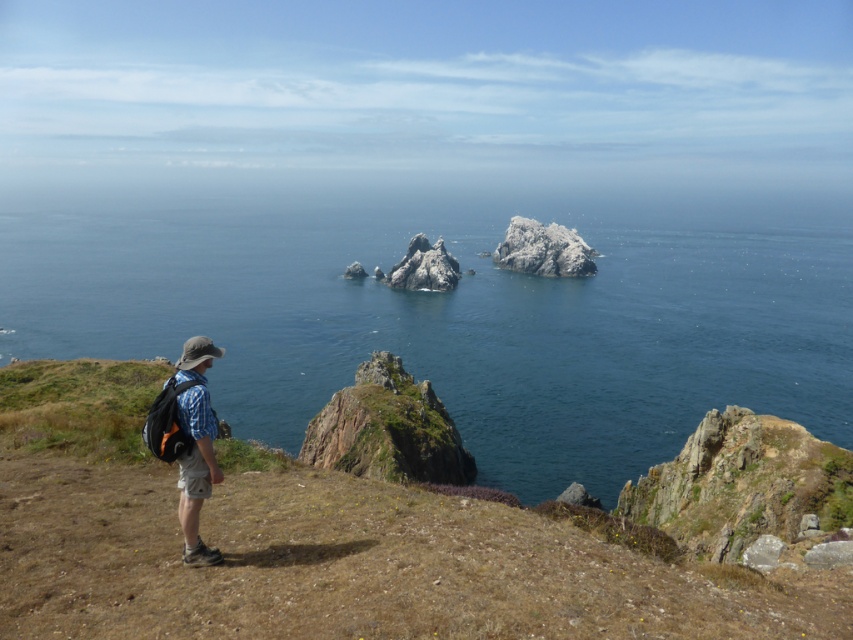
Between brown grassy hillside at lower left and rugged stone rock formation at center, which one has less height?

Standing shorter between the two is brown grassy hillside at lower left.

Can you confirm if brown grassy hillside at lower left is taller than rugged stone rock formation at center?

Incorrect, brown grassy hillside at lower left's height is not larger of rugged stone rock formation at center's.

Measure the distance between brown grassy hillside at lower left and camera.

They are 36.61 feet apart.

Locate an element on the screen. The image size is (853, 640). brown grassy hillside at lower left is located at coordinates (326, 545).

In the scene shown: Does blue water at center appear on the right side of white rocky island at center?

In fact, blue water at center is to the left of white rocky island at center.

Between blue water at center and white rocky island at center, which one is positioned higher?

blue water at center is above.

Is point (531, 364) behind point (524, 252)?

That is False.

You are a GUI agent. You are given a task and a screenshot of the screen. Output one action in this format:
    pyautogui.click(x=<x>, y=<y>)
    Task: Click on the blue water at center
    
    Given the screenshot: What is the action you would take?
    pyautogui.click(x=456, y=310)

Is the position of blue water at center less distant than that of rugged stone rock formation at center?

Yes, it is in front of rugged stone rock formation at center.

Does blue water at center appear on the right side of rugged stone rock formation at center?

Incorrect, blue water at center is not on the right side of rugged stone rock formation at center.

Does point (799, 368) come farther from viewer compared to point (416, 240)?

That is False.

Where is `blue water at center`? blue water at center is located at coordinates (456, 310).